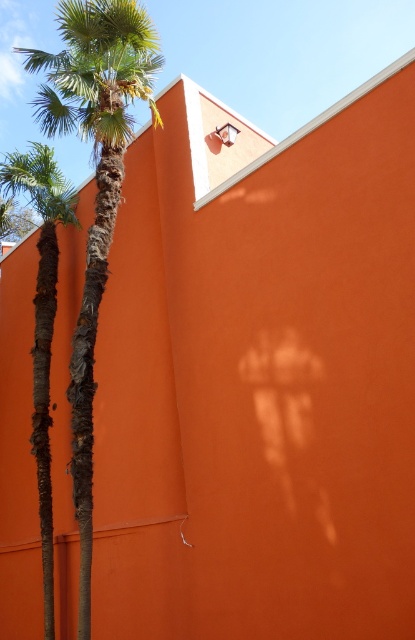
Is point (90, 256) more distant than point (36, 188)?

No, (90, 256) is closer to viewer.

Is green leafy palm tree at left to the left of green textured palm tree at left from the viewer's perspective?

In fact, green leafy palm tree at left is to the right of green textured palm tree at left.

Which is behind, point (90, 136) or point (48, 579)?

Point (90, 136)

This screenshot has width=415, height=640. I want to click on green leafy palm tree at left, so click(x=97, y=189).